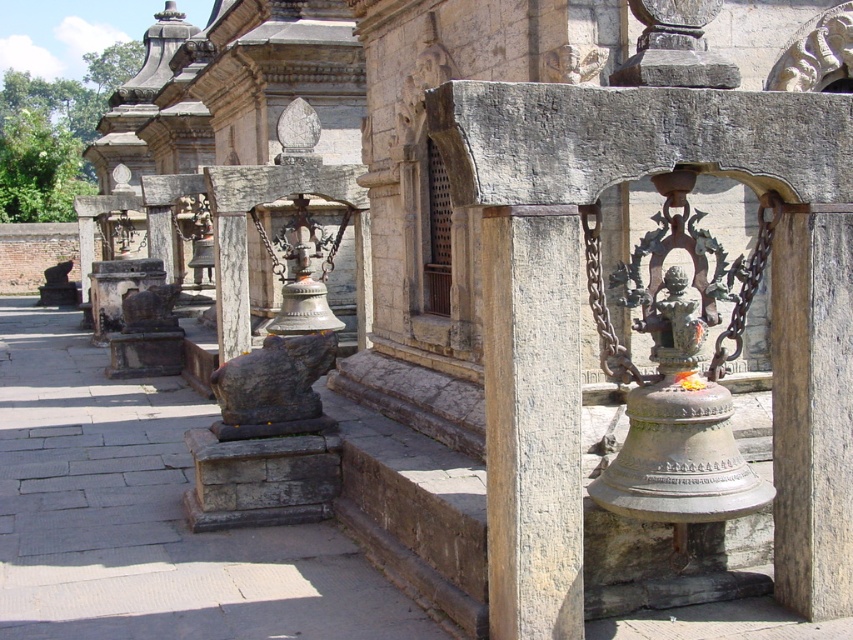
Question: Is brown stone pillar at center bigger than rusty stone statue at center?

Choices:
 (A) no
 (B) yes

Answer: (B)

Question: From the image, what is the correct spatial relationship of brown stone pillar at center in relation to rusty stone statue at center?

Choices:
 (A) above
 (B) below

Answer: (A)

Question: Does brown stone pillar at center lie behind rusty stone statue at center?

Choices:
 (A) yes
 (B) no

Answer: (B)

Question: Which of the following is the farthest from the observer?

Choices:
 (A) (488, 532)
 (B) (297, 365)

Answer: (B)